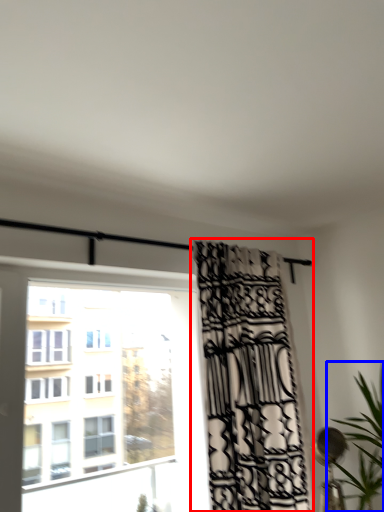
Question: Which point is further to the camera, curtain (highlighted by a red box) or houseplant (highlighted by a blue box)?

Choices:
 (A) curtain
 (B) houseplant

Answer: (A)